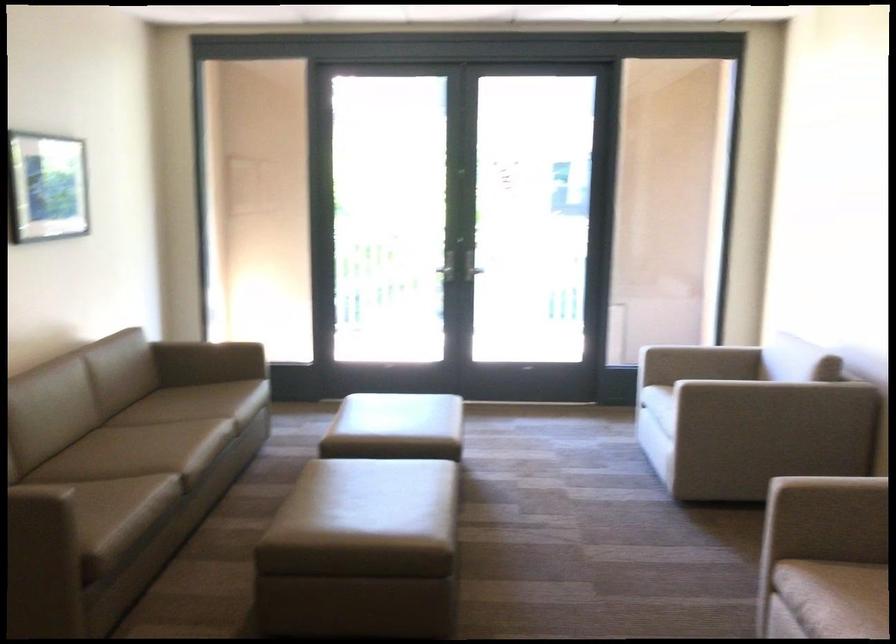
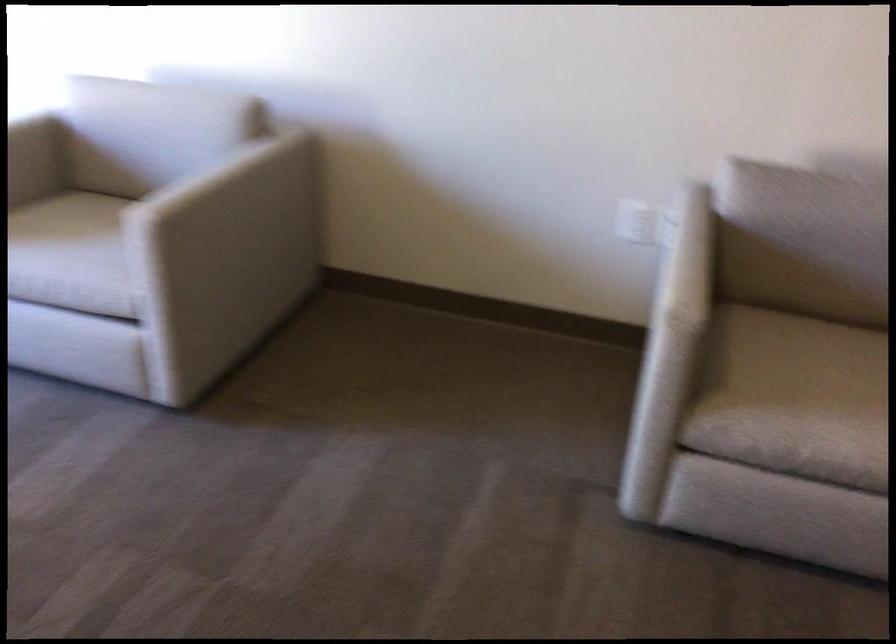
Find the pixel in the second image that matches point (728, 383) in the first image.

(209, 180)